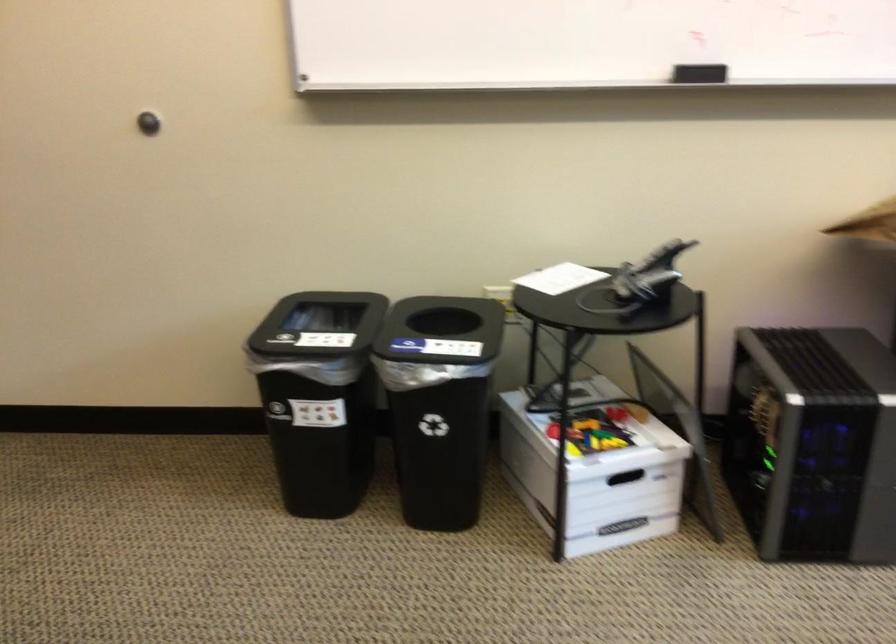
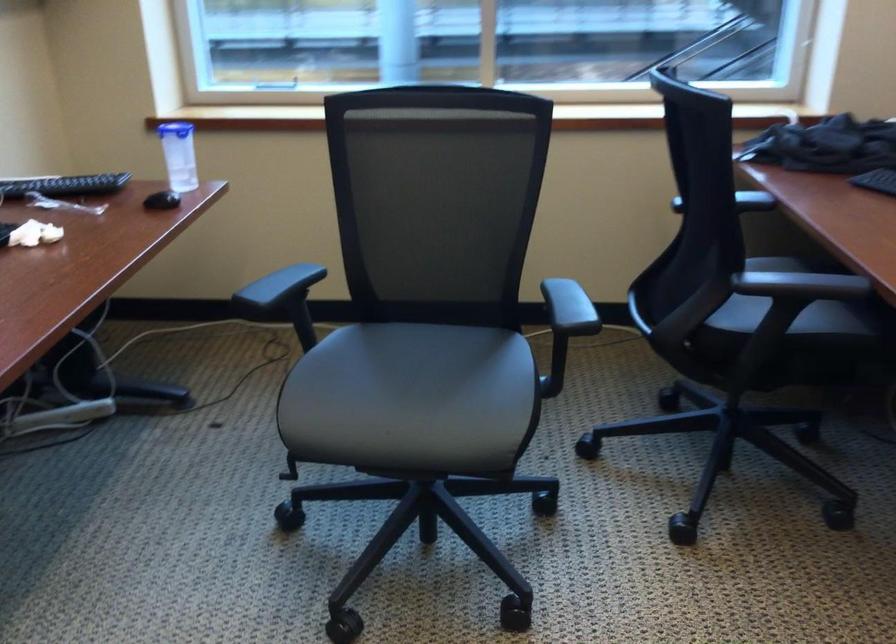
The first image is from the beginning of the video and the second image is from the end. How did the camera likely rotate when shooting the video?

The camera rotated toward right-down.